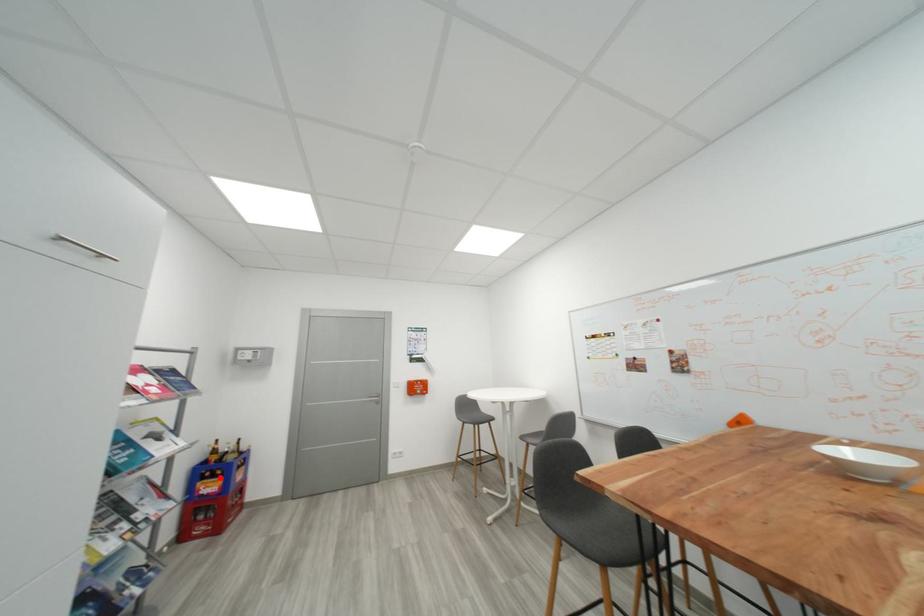
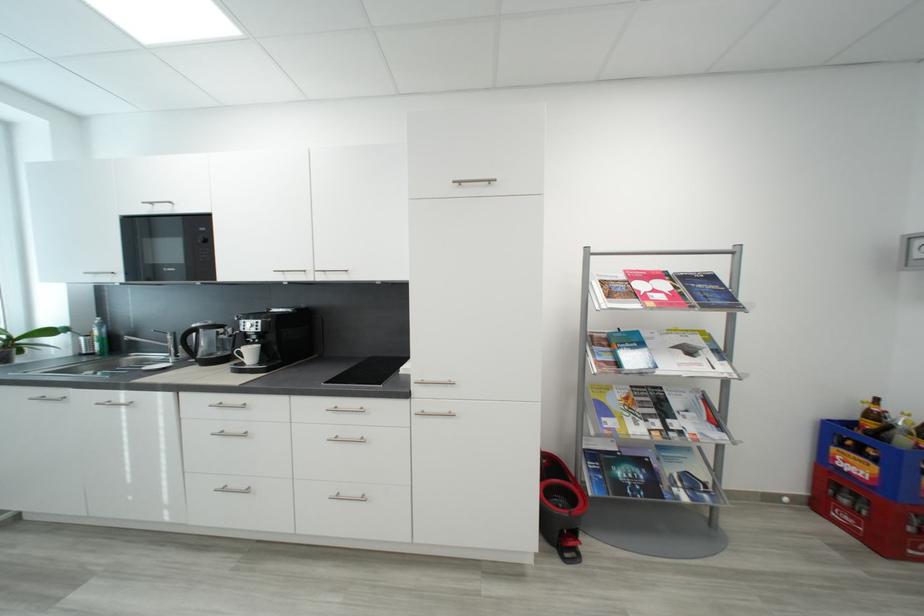
Question: I am providing you with two images of the same scene from different viewpoints. A red point is shown in image1. For the corresponding object point in image2, is it positioned nearer or farther from the camera?

Choices:
 (A) Nearer
 (B) Farther

Answer: (A)